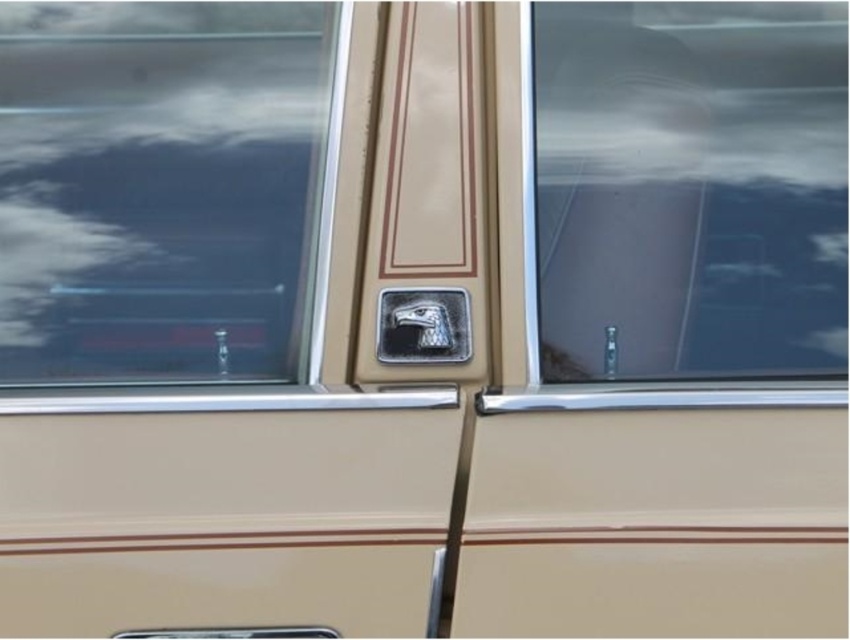
You are a car designer trying to place a new emblem on the door panel. The current emblem is at the center of the door panel. You want to place a new emblem 10 cm to the left of the transparent glass window at center. Where should you place the new emblem?

The 2D location of transparent glass window at center is at point (690,186), so placing the new emblem 10 cm to the left of this point would be at coordinates 0.292 minus 10 cm in the x direction. However, without knowing the scale of the coordinate system, it is impossible to determine the exact placement in real world measurements.

You are a car salesman trying to explain the car features to a customer. You point to the transparent glass window at left and the transparent glass window at center. Which one is wider?

The transparent glass window at left is wider than the transparent glass window at center according to the description.

You are a car detailer and need to clean both the transparent glass window at left and the metallic eagle head at center. If you have a cloth that can only cover an area up to the size of the smaller object, which object should you use it on first?

The metallic eagle head at center is smaller than the transparent glass window at left. You should use the cloth on the metallic eagle head at center first since it is smaller and the cloth can fully cover it before moving to the larger window.